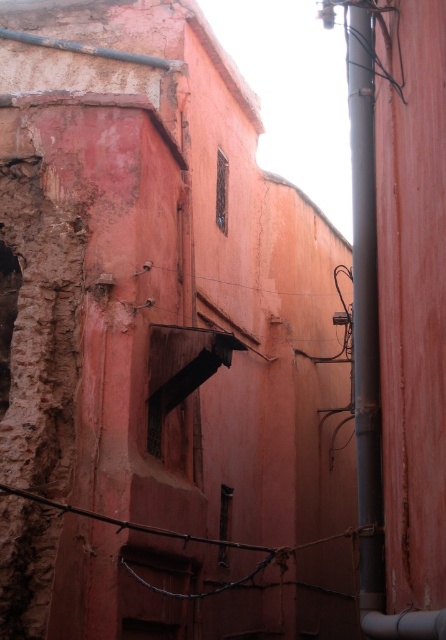
Is point (375, 189) farther from camera compared to point (156, 528)?

No, (375, 189) is closer to viewer.

At what (x,y) coordinates should I click in order to perform the action: click on metallic pipe at right. Please return your answer as a coordinate pair (x, y). Looking at the image, I should click on (364, 310).